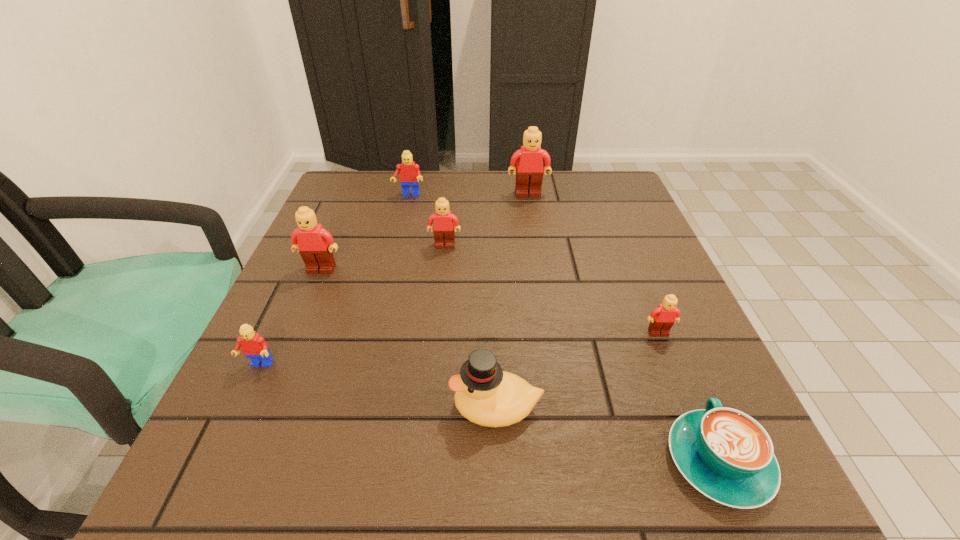
Where is `the second brown Lego from right to left`? The width and height of the screenshot is (960, 540). the second brown Lego from right to left is located at coordinates (529, 171).

This screenshot has width=960, height=540. I want to click on the tallest Lego, so click(529, 171).

Where is `the fourth farthest object`? The width and height of the screenshot is (960, 540). the fourth farthest object is located at coordinates (314, 243).

I want to click on the fourth farthest Lego, so click(x=314, y=243).

Locate an element on the screen. the fourth Lego from right to left is located at coordinates (410, 175).

Locate an element on the screen. This screenshot has height=540, width=960. the farther red Lego is located at coordinates 410,175.

At what (x,y) coordinates should I click in order to perform the action: click on the third farthest Lego. Please return your answer as a coordinate pair (x, y). The width and height of the screenshot is (960, 540). Looking at the image, I should click on (444, 221).

At what (x,y) coordinates should I click in order to perform the action: click on the second farthest brown Lego. Please return your answer as a coordinate pair (x, y). This screenshot has width=960, height=540. Looking at the image, I should click on (444, 221).

Find the location of a particular element. yellow duck is located at coordinates (486, 395).

At what (x,y) coordinates should I click in order to perform the action: click on the rightmost Lego. Please return your answer as a coordinate pair (x, y). The image size is (960, 540). Looking at the image, I should click on (663, 317).